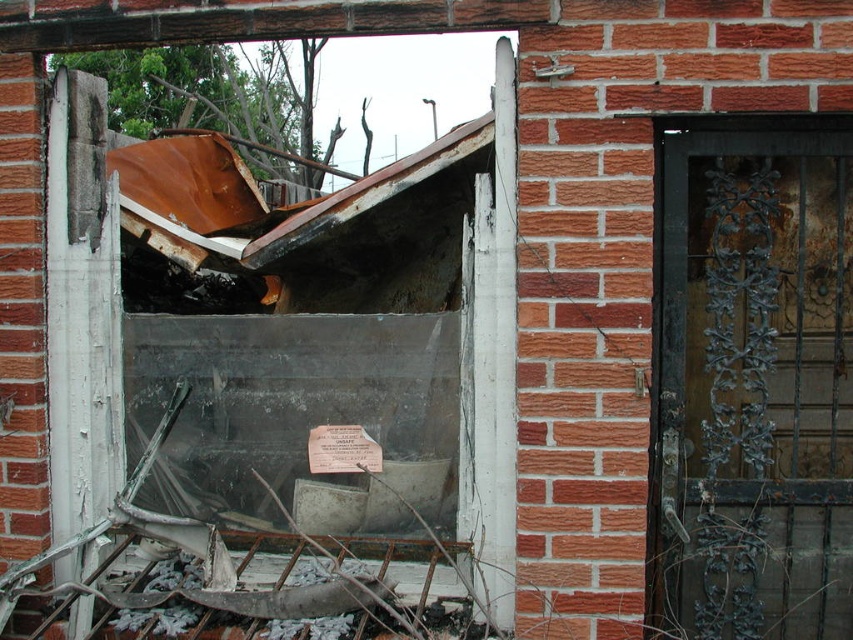
Question: Which of the following is the closest to the observer?

Choices:
 (A) (397, 285)
 (B) (712, 368)

Answer: (B)

Question: Is rusty metal window at center smaller than rusty metal door at right?

Choices:
 (A) no
 (B) yes

Answer: (A)

Question: Is rusty metal window at center smaller than rusty metal door at right?

Choices:
 (A) yes
 (B) no

Answer: (B)

Question: Does rusty metal window at center appear on the left side of rusty metal door at right?

Choices:
 (A) yes
 (B) no

Answer: (A)